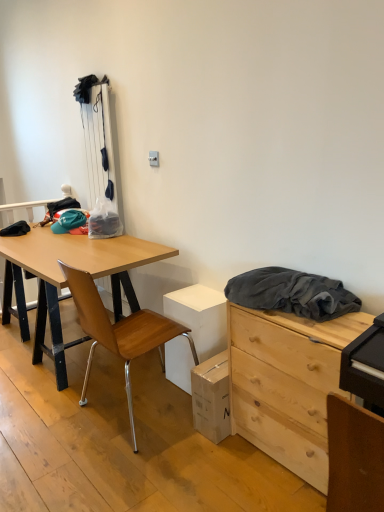
Image resolution: width=384 pixels, height=512 pixels. Find the location of `free location in front of wooden at left`. free location in front of wooden at left is located at coordinates (119, 473).